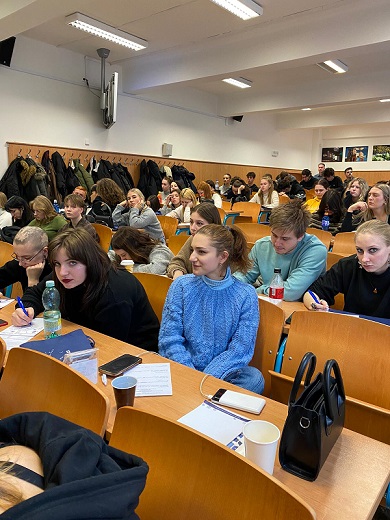
I want to click on ceiling, so click(181, 20), click(285, 96), click(360, 115).